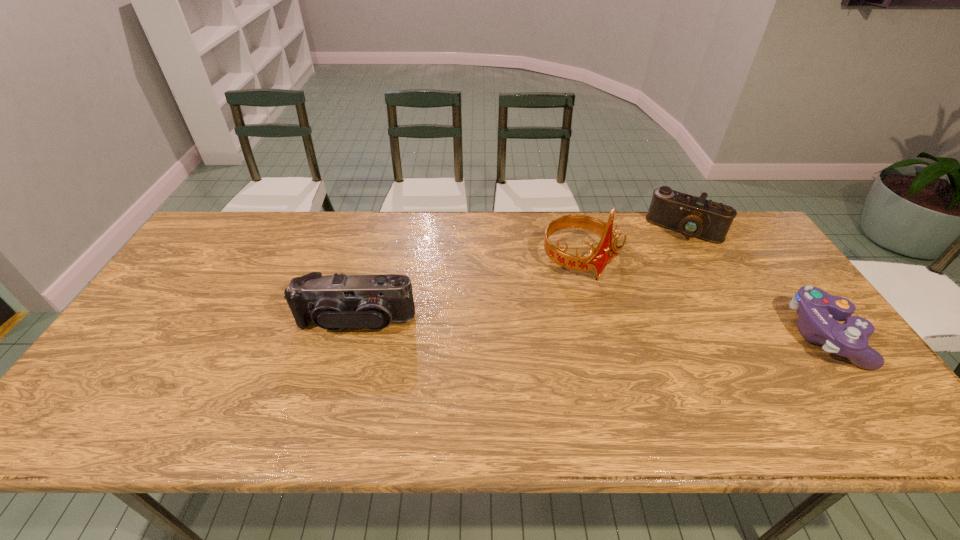
I want to click on object that is the closest to the camcorder, so point(597,259).

I want to click on free space that satisfies the following two spatial constraints: 1. on the front side of the rightmost object; 2. on the left side of the tiara, so click(597, 336).

Locate an element on the screen. The image size is (960, 540). vacant position in the image that satisfies the following two spatial constraints: 1. on the front-facing side of the shortest object; 2. on the left side of the second tallest object is located at coordinates (352, 336).